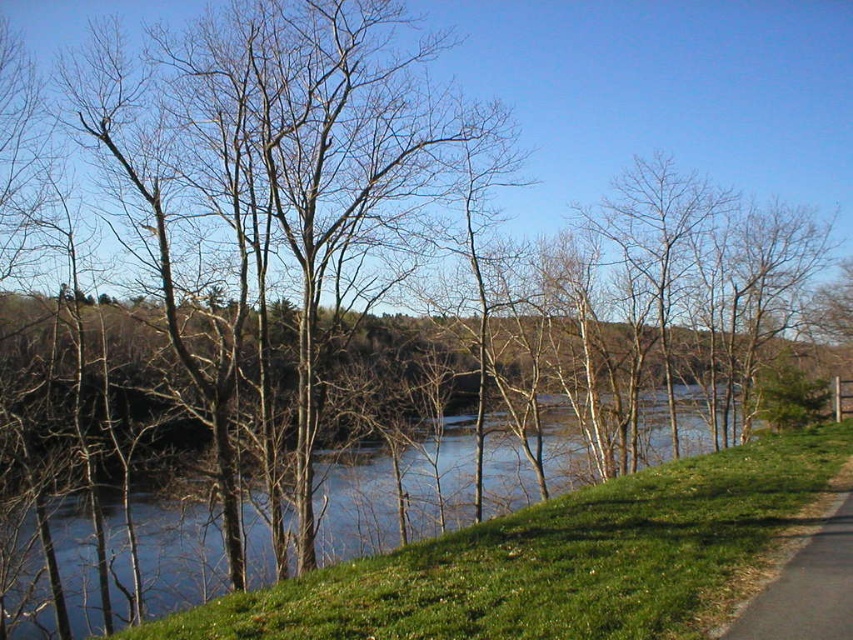
Is the position of blue water at center more distant than that of black asphalt path at lower right?

Yes, it is.

Who is shorter, blue water at center or black asphalt path at lower right?

Standing shorter between the two is black asphalt path at lower right.

What do you see at coordinates (177, 556) in the screenshot? I see `blue water at center` at bounding box center [177, 556].

Image resolution: width=853 pixels, height=640 pixels. Identify the location of blue water at center. (177, 556).